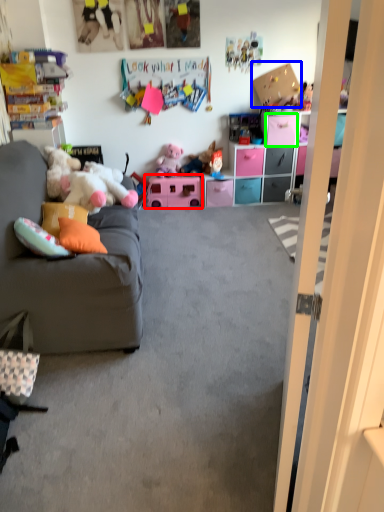
Question: Which object is positioned farthest from toy (highlighted by a red box)? Select from cardboard box (highlighted by a blue box) and drawer (highlighted by a green box).

Choices:
 (A) cardboard box
 (B) drawer

Answer: (A)